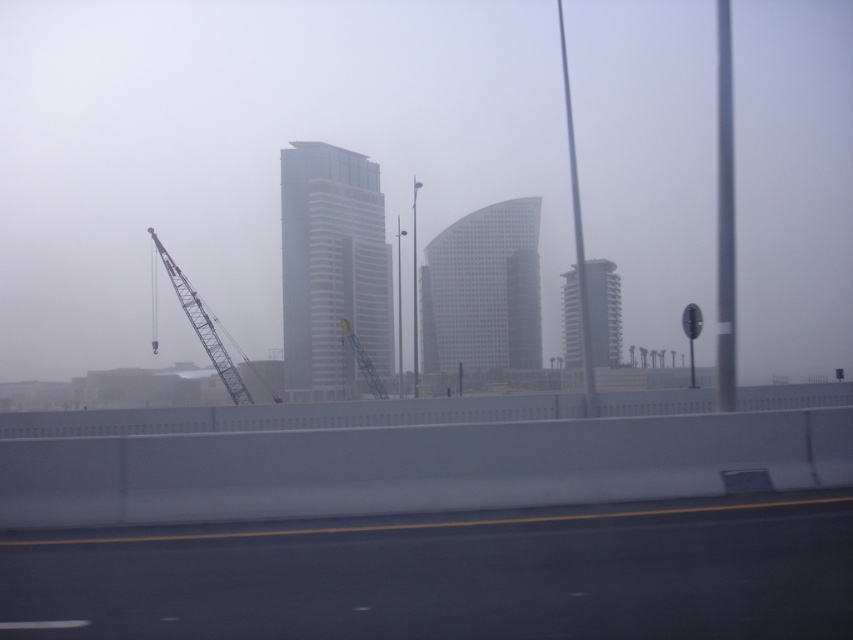
Is white glass building at center below smooth glass tower at center?

Actually, white glass building at center is above smooth glass tower at center.

Can you confirm if white glass building at center is thinner than smooth glass tower at center?

No, white glass building at center is not thinner than smooth glass tower at center.

Locate an element on the screen. The height and width of the screenshot is (640, 853). white glass building at center is located at coordinates (332, 266).

In the scene shown: Can you confirm if white glass building at center is positioned above clear glass building at center?

Yes.

Who is more forward, (352, 227) or (477, 324)?

Point (352, 227) is more forward.

Does point (314, 150) lie behind point (520, 248)?

No, it is in front of (520, 248).

Where is `white glass building at center`? This screenshot has height=640, width=853. white glass building at center is located at coordinates (332, 266).

Based on the photo, does black asphalt road at lower center have a lesser height compared to metallic blue crane at left?

Yes, black asphalt road at lower center is shorter than metallic blue crane at left.

Who is positioned more to the right, black asphalt road at lower center or metallic blue crane at left?

From the viewer's perspective, black asphalt road at lower center appears more on the right side.

Where is `black asphalt road at lower center`? The width and height of the screenshot is (853, 640). black asphalt road at lower center is located at coordinates click(x=451, y=573).